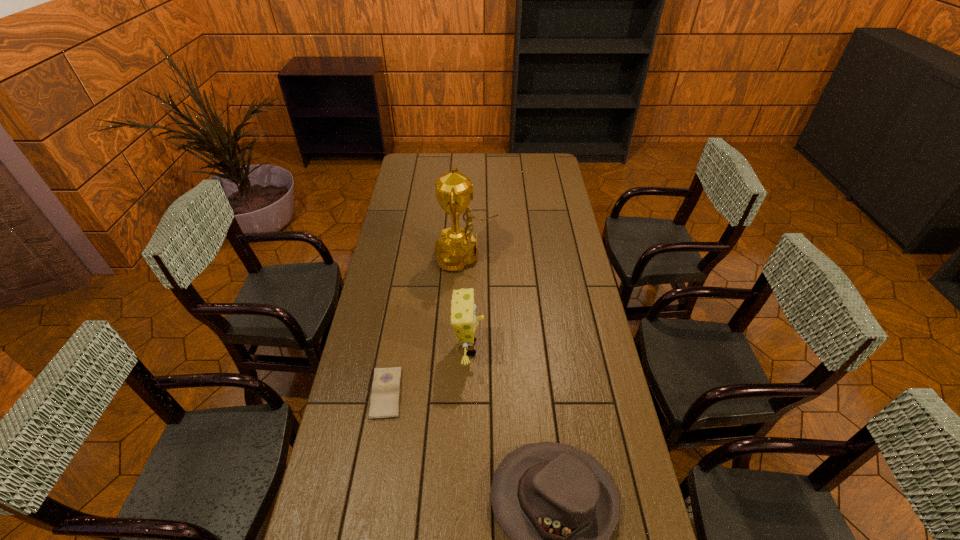
I want to click on vacant space at the left edge of the desktop, so click(371, 502).

This screenshot has height=540, width=960. In the image, there is a desktop. Find the location of `free region at the right edge`. free region at the right edge is located at coordinates (572, 428).

At what (x,y) coordinates should I click in order to perform the action: click on empty space between the farthest object and the shortest object. Please return your answer as a coordinate pair (x, y). The image size is (960, 540). Looking at the image, I should click on (426, 325).

Image resolution: width=960 pixels, height=540 pixels. I want to click on vacant region between the award and the leftmost object, so click(x=426, y=325).

Locate an element on the screen. object that is the second closest to the second shortest object is located at coordinates (384, 404).

Locate which object ranks third in proximity to the nearest object. Please provide its 2D coordinates. Your answer should be formatted as a tuple, i.e. [(x, y)], where the tuple contains the x and y coordinates of a point satisfying the conditions above.

[(457, 248)]

The image size is (960, 540). I want to click on free space that satisfies the following two spatial constraints: 1. on the face of the sponge; 2. on the front side of the leftmost object, so click(468, 393).

Where is `vacant area in the image that satisfies the following two spatial constraints: 1. on the face of the third shortest object; 2. on the front side of the shortest object`? This screenshot has width=960, height=540. vacant area in the image that satisfies the following two spatial constraints: 1. on the face of the third shortest object; 2. on the front side of the shortest object is located at coordinates (468, 393).

The width and height of the screenshot is (960, 540). I want to click on vacant space that satisfies the following two spatial constraints: 1. on the front side of the farthest object; 2. on the front side of the shortest object, so click(461, 393).